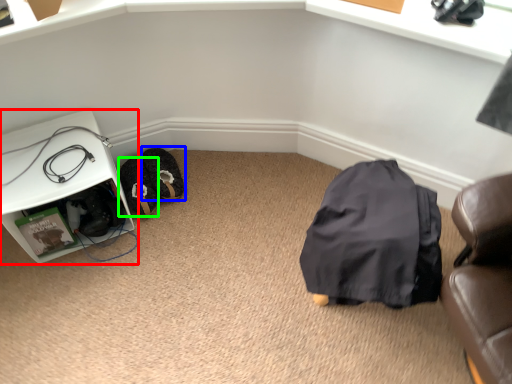
Question: Based on their relative distances, which object is farther from furniture (highlighted by a red box)? Choose from footwear (highlighted by a blue box) and shoe (highlighted by a green box).

Choices:
 (A) footwear
 (B) shoe

Answer: (A)